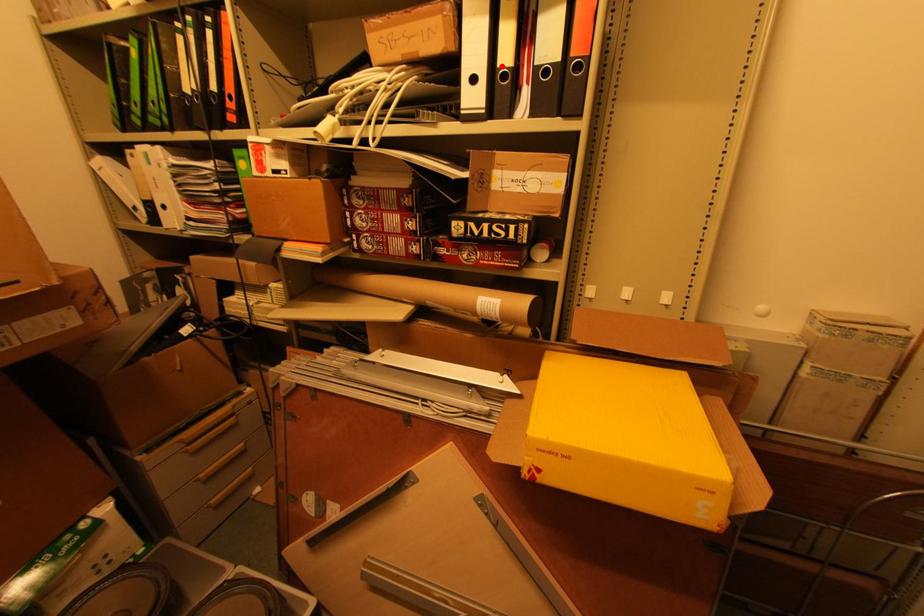
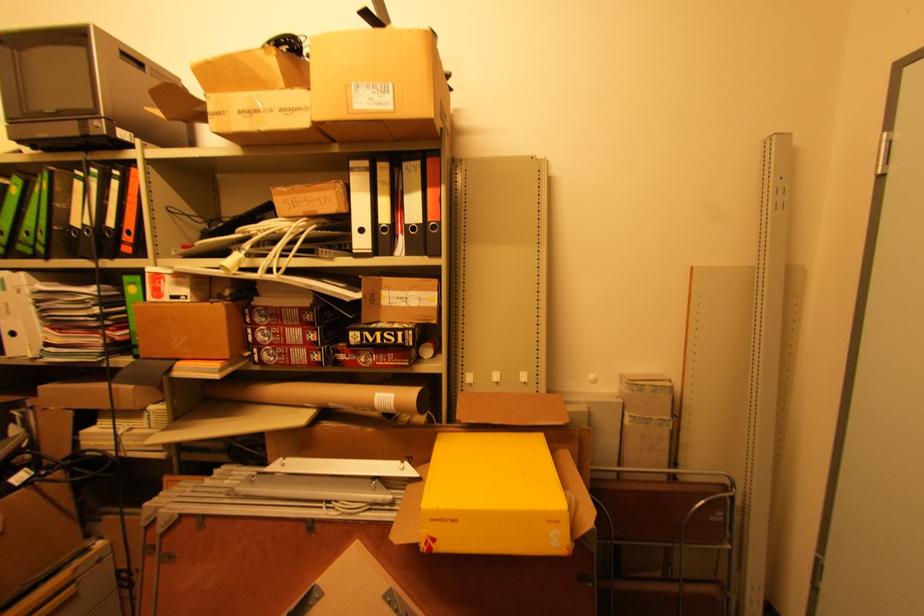
Where in the second image is the point corresponding to the highlighted location from the first image?

(383, 223)